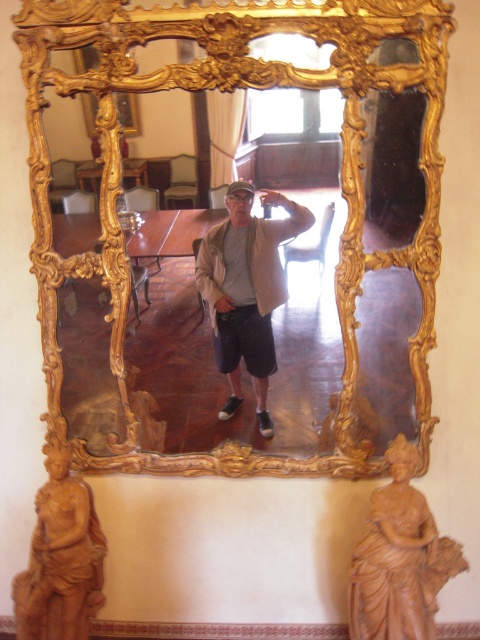
Question: Estimate the real-world distances between objects in this image. Which object is farther from the matte beige jacket at center?

Choices:
 (A) brown wood statue at lower right
 (B) brown terracotta statue at lower left

Answer: (B)

Question: Does gold ornate mirror at center have a lesser width compared to brown terracotta statue at lower left?

Choices:
 (A) yes
 (B) no

Answer: (B)

Question: Does gold ornate mirror at center have a larger size compared to brown terracotta statue at lower left?

Choices:
 (A) no
 (B) yes

Answer: (B)

Question: Where is gold ornate mirror at center located in relation to brown terracotta statue at lower left in the image?

Choices:
 (A) below
 (B) above

Answer: (B)

Question: Which of these objects is positioned closest to the matte beige jacket at center?

Choices:
 (A) brown terracotta statue at lower left
 (B) brown wood statue at lower right

Answer: (B)

Question: Based on their relative distances, which object is nearer to the gold ornate mirror at center?

Choices:
 (A) brown wood statue at lower right
 (B) matte beige jacket at center
 (C) brown terracotta statue at lower left

Answer: (B)